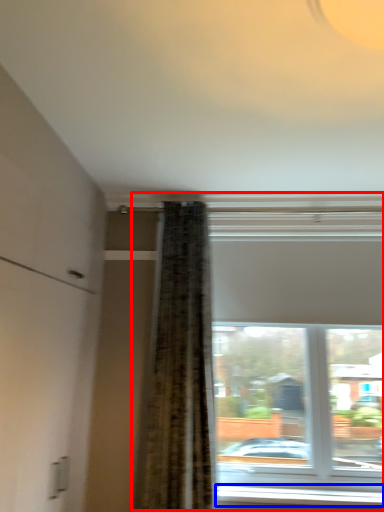
Question: Among these objects, which one is farthest to the camera, window (highlighted by a red box) or window sill (highlighted by a blue box)?

Choices:
 (A) window
 (B) window sill

Answer: (B)